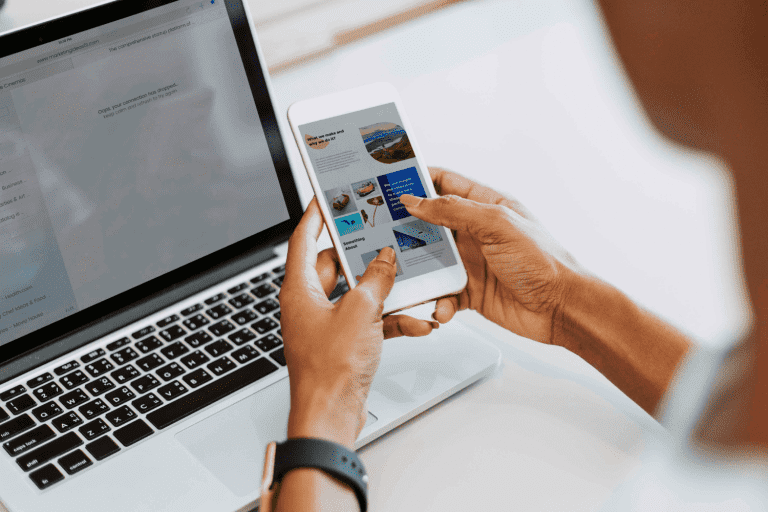
At what (x,y) coordinates should I click in order to perform the action: click on screen. Please return your answer as a coordinate pair (x, y). Looking at the image, I should click on tap(153, 247).